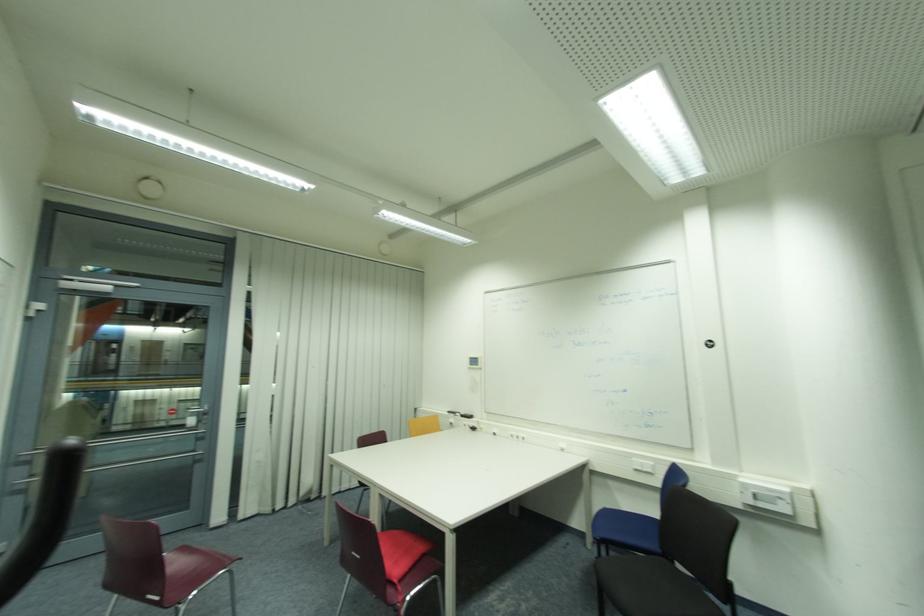
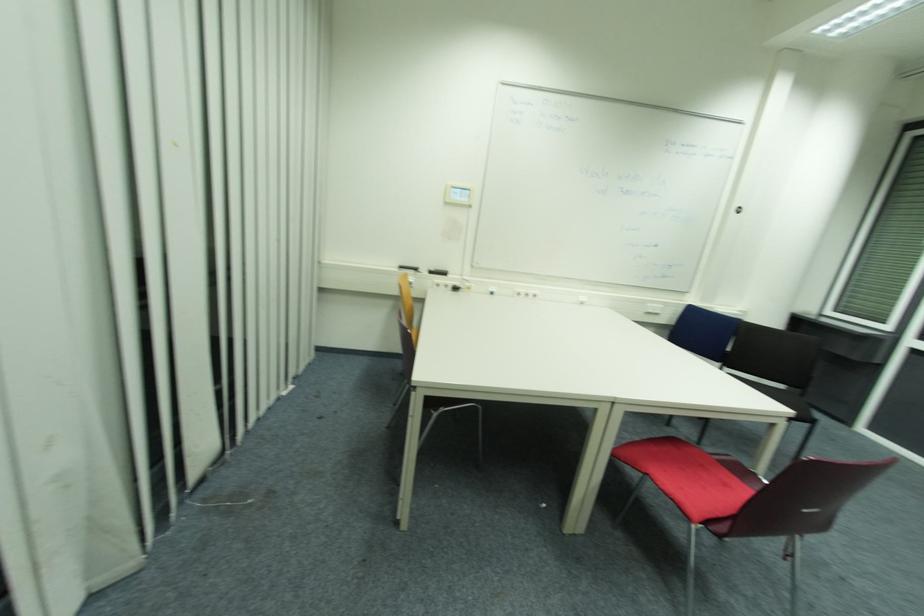
Locate, in the second image, the point that corresponds to point (478, 430) in the first image.

(458, 290)